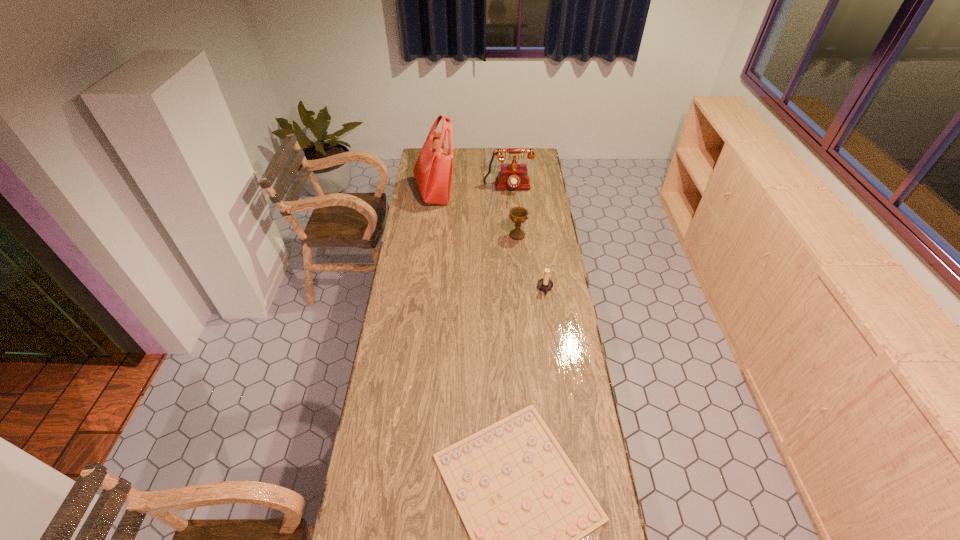
In order to click on vacant space that satisfies the following two spatial constraints: 1. on the dial of the telephone; 2. on the front-facing side of the handbag in this screenshot , I will do `click(508, 192)`.